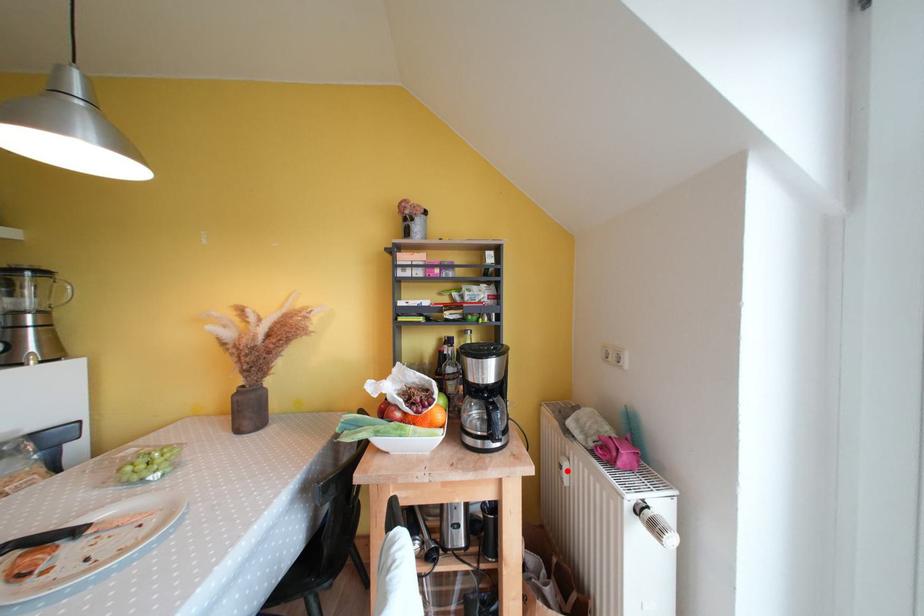
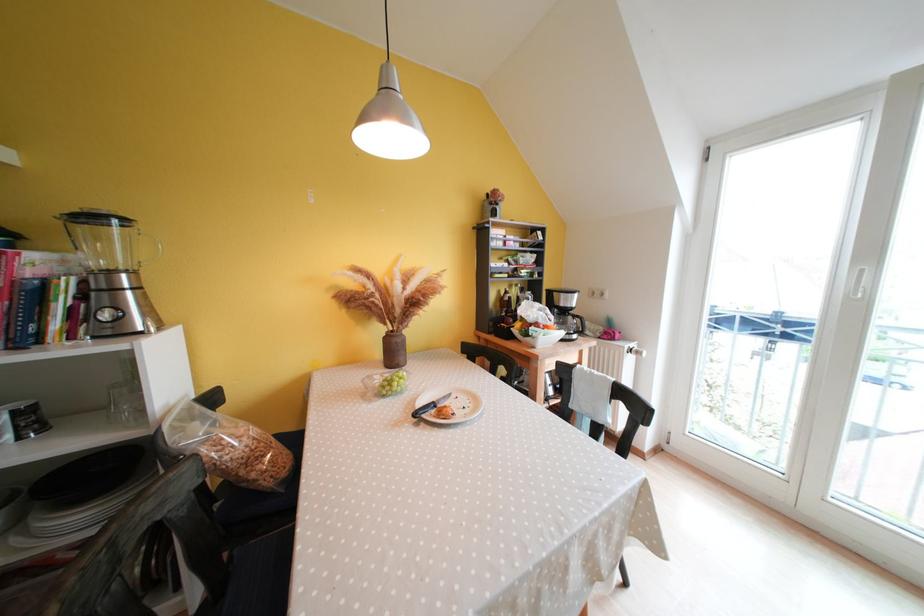
Question: I am providing you with two images of the same scene from different viewpoints. A red point is marked on the first image. Is the red point's position out of view in image 2?

Choices:
 (A) Yes
 (B) No

Answer: (A)